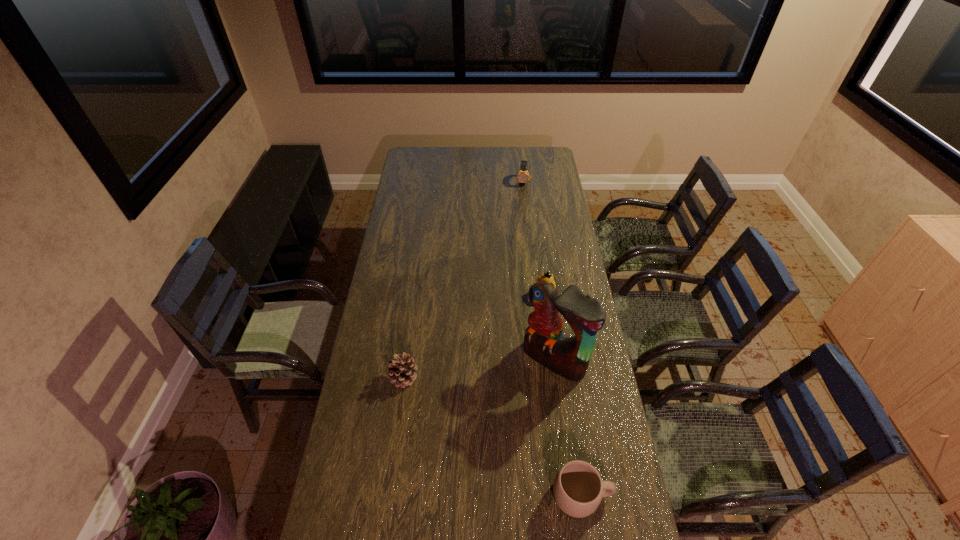
Where is `vacant area that satisfies the following two spatial constraints: 1. on the front side of the mug; 2. on the side of the parrot with the handle`? The image size is (960, 540). vacant area that satisfies the following two spatial constraints: 1. on the front side of the mug; 2. on the side of the parrot with the handle is located at coordinates (572, 495).

Identify the location of vacant area in the image that satisfies the following two spatial constraints: 1. on the back side of the parrot; 2. on the right side of the leftmost object. The width and height of the screenshot is (960, 540). (406, 360).